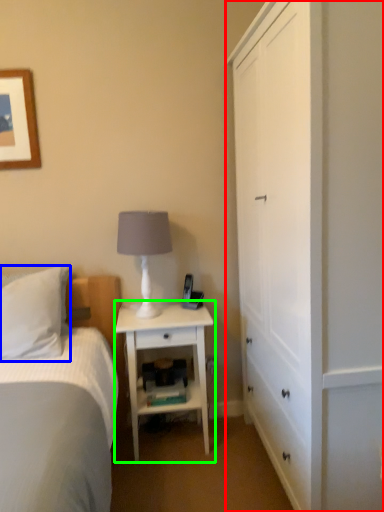
Question: Estimate the real-world distances between objects in this image. Which object is farther from cabinetry (highlighted by a red box), pillow (highlighted by a blue box) or nightstand (highlighted by a green box)?

Choices:
 (A) pillow
 (B) nightstand

Answer: (A)